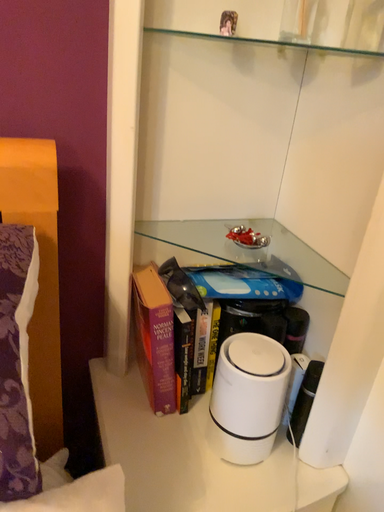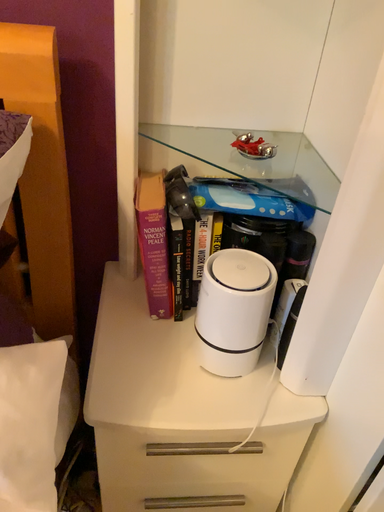
Question: Which way did the camera rotate in the video?

Choices:
 (A) rotated upward
 (B) rotated downward

Answer: (B)